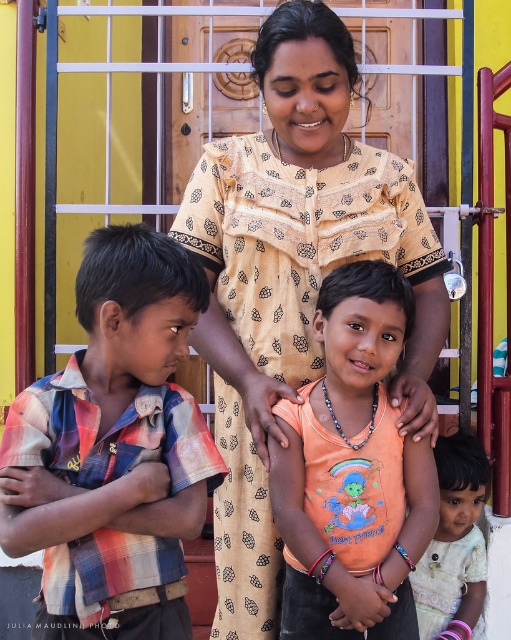
You are a photographer trying to arrange two children wearing a plaid cotton shirt at left and an orange cotton shirt at center for a photo. Which child should you move to the right to create space between them?

The plaid cotton shirt at left is positioned on the left side of orange cotton shirt at center, so you should move the child in the orange cotton shirt at center to the right to create space between them.

Based on the photo, you are a photographer setting up for a family photo. You notice the beige printed dress at center and the plaid cotton shirt at left in the scene. Which clothing item is covering part of the other?

The beige printed dress at center is positioned over the plaid cotton shirt at left, so it is covering part of it.

You are taking a photo of the scene and want to focus on both point (131, 282) and point (291, 492). Which point is closer to your camera lens?

Point (131, 282) is closer to the camera lens than point (291, 492).